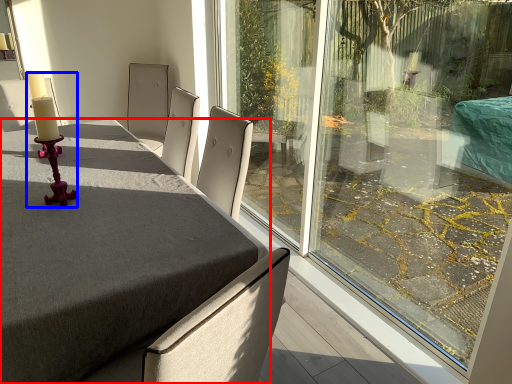
Question: Which of the following is the farthest to the observer, table (highlighted by a red box) or candle holder (highlighted by a blue box)?

Choices:
 (A) table
 (B) candle holder

Answer: (B)